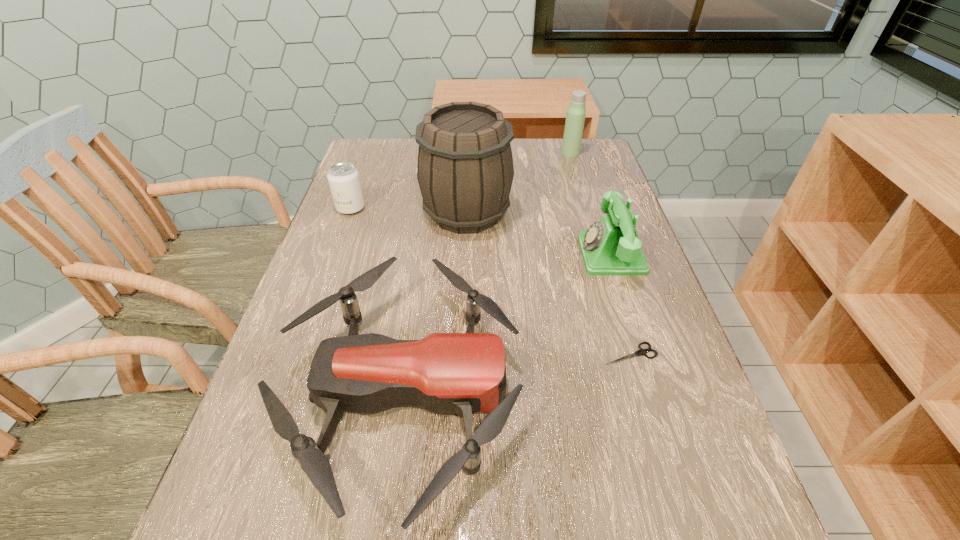
Identify the location of free location at the right edge. (704, 524).

Image resolution: width=960 pixels, height=540 pixels. I want to click on free spot at the far right corner of the desktop, so click(606, 163).

Where is `vacant area between the soda can and the tallest object`? vacant area between the soda can and the tallest object is located at coordinates (409, 211).

The width and height of the screenshot is (960, 540). Find the location of `free spot between the telephone and the tallest object`. free spot between the telephone and the tallest object is located at coordinates (539, 234).

Find the location of a particular element. Image resolution: width=960 pixels, height=540 pixels. vacant point located between the farthest object and the wine bucket is located at coordinates (518, 183).

The image size is (960, 540). I want to click on free space between the thermos bottle and the telephone, so click(x=590, y=204).

This screenshot has height=540, width=960. In order to click on free space between the tallest object and the thermos bottle in this screenshot , I will do `click(518, 183)`.

The height and width of the screenshot is (540, 960). I want to click on vacant point located between the tallest object and the shears, so click(548, 284).

Find the location of `the fifth closest object relative to the drone`. the fifth closest object relative to the drone is located at coordinates (575, 117).

Identify the location of the fifth closest object to the shortest object. (575, 117).